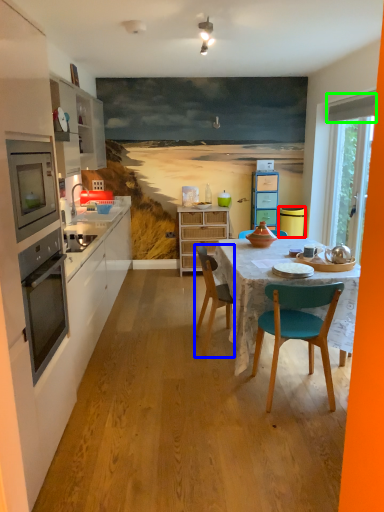
Question: Estimate the real-world distances between objects in this image. Which object is closer to trash bin/can (highlighted by a red box), chair (highlighted by a blue box) or exhaust hood (highlighted by a green box)?

Choices:
 (A) chair
 (B) exhaust hood

Answer: (B)